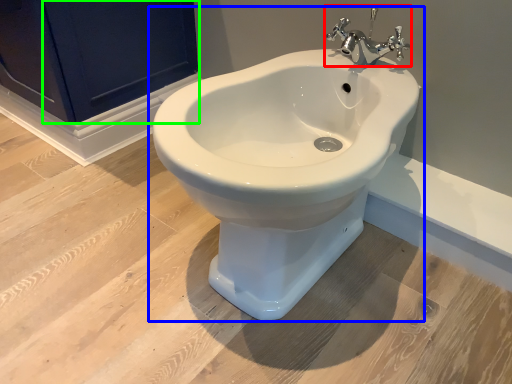
Question: Estimate the real-world distances between objects in this image. Which object is closer to tap (highlighted by a red box), toilet (highlighted by a blue box) or screen door (highlighted by a green box)?

Choices:
 (A) toilet
 (B) screen door

Answer: (A)